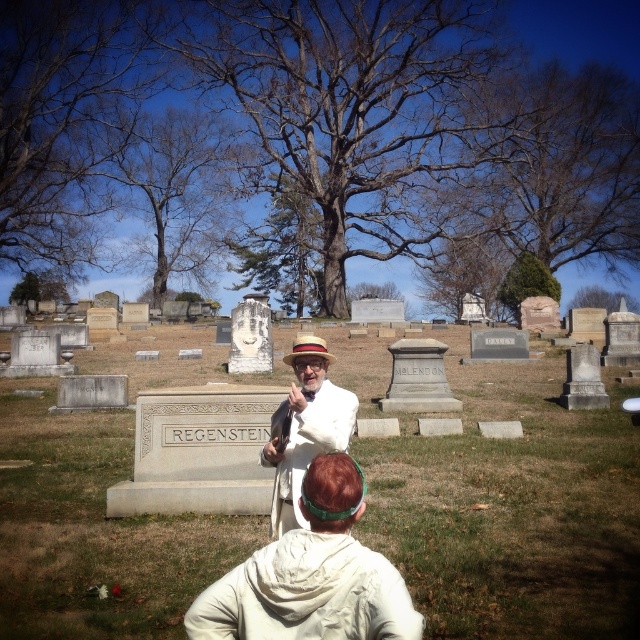
Question: Does white cotton hoodie at center appear over brown straw cowboy hat at center?

Choices:
 (A) no
 (B) yes

Answer: (A)

Question: Which is nearer to the brown straw cowboy hat at center?

Choices:
 (A) white cotton hoodie at center
 (B) gray stone gravestone at center

Answer: (A)

Question: Among these points, which one is farthest from the camera?

Choices:
 (A) (292, 524)
 (B) (323, 355)

Answer: (B)

Question: Can you confirm if gray stone gravestone at center is positioned above white cotton hoodie at center?

Choices:
 (A) no
 (B) yes

Answer: (B)

Question: Which point is farther from the camera taking this photo?

Choices:
 (A) (320, 355)
 (B) (205, 545)

Answer: (B)

Question: Is white cotton hoodie at center closer to the viewer compared to white cotton suit at center?

Choices:
 (A) yes
 (B) no

Answer: (A)